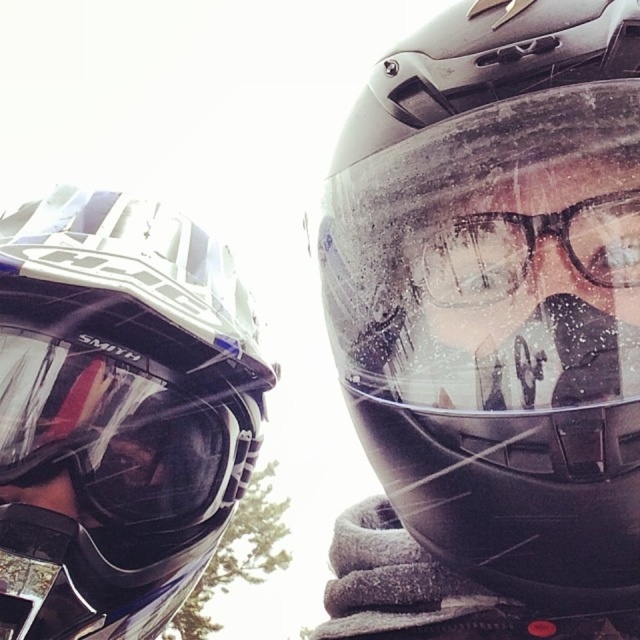
Question: Does matte black helmet at upper left appear under transparent plastic glasses at center?

Choices:
 (A) no
 (B) yes

Answer: (B)

Question: Which point is closer to the camera?

Choices:
 (A) transparent plastic glasses at center
 (B) matte black helmet at upper left
 (C) matte black helmet at center

Answer: (C)

Question: Can you confirm if matte black helmet at center is positioned to the right of matte black helmet at upper left?

Choices:
 (A) no
 (B) yes

Answer: (B)

Question: Which point is farther from the camera taking this photo?

Choices:
 (A) [531, 1]
 (B) [582, 260]

Answer: (A)

Question: Can you confirm if matte black helmet at upper left is positioned above transparent plastic glasses at center?

Choices:
 (A) yes
 (B) no

Answer: (B)

Question: Considering the real-world distances, which object is closest to the matte black helmet at center?

Choices:
 (A) transparent plastic glasses at center
 (B) matte black helmet at upper left

Answer: (A)